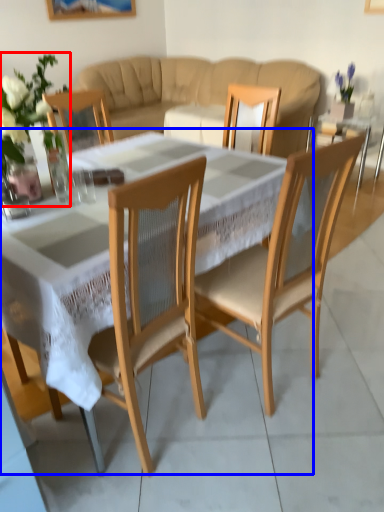
Question: Which object appears farthest to the camera in this image, floral arrangement (highlighted by a red box) or coffee table (highlighted by a blue box)?

Choices:
 (A) floral arrangement
 (B) coffee table

Answer: (A)